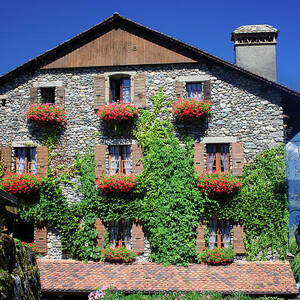
You are a GUI agent. You are given a task and a screenshot of the screen. Output one action in this format:
    pyautogui.click(x=<x>, y=<y>)
    Task: Click on the window
    This screenshot has height=300, width=300.
    Given the screenshot: What is the action you would take?
    pyautogui.click(x=219, y=161)